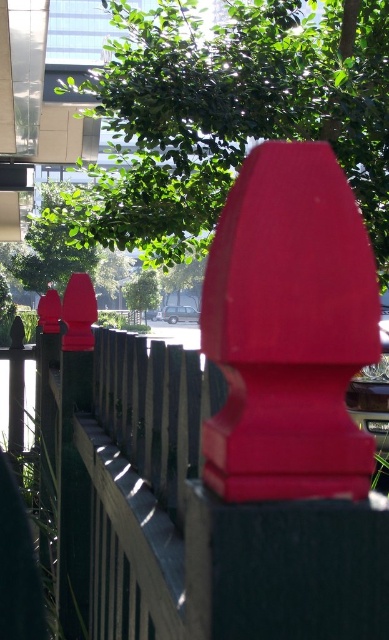
Question: Which object appears farthest from the camera in this image?

Choices:
 (A) green leafy tree at upper center
 (B) matte wood fence at center

Answer: (A)

Question: Is matte wood fence at center smaller than green leafy tree at upper center?

Choices:
 (A) yes
 (B) no

Answer: (A)

Question: Where is green leafy tree at upper center located in relation to matte plastic fence post at center in the image?

Choices:
 (A) below
 (B) above

Answer: (B)

Question: Does matte wood fence at center have a smaller size compared to green leafy tree at upper center?

Choices:
 (A) no
 (B) yes

Answer: (B)

Question: Among these points, which one is nearest to the camera?

Choices:
 (A) (187, 90)
 (B) (47, 529)

Answer: (B)

Question: Which object is farther from the camera taking this photo?

Choices:
 (A) matte plastic fence post at center
 (B) green leafy tree at upper center

Answer: (B)